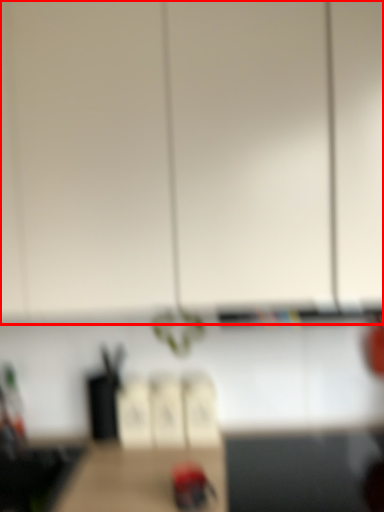
Question: Where is cabinetry (annotated by the red box) located in relation to woodpecker in the image?

Choices:
 (A) right
 (B) left

Answer: (B)